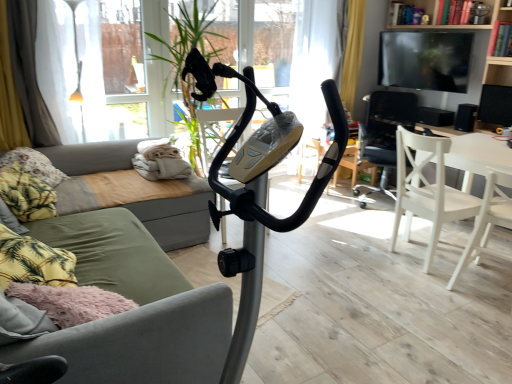
At what (x,y) coordinates should I click in order to perform the action: click on blank area beneath white wood chair at right, acting as the first chair starting from the front (from a real-world perspective). Please return your answer as a coordinate pair (x, y). Looking at the image, I should click on (485, 286).